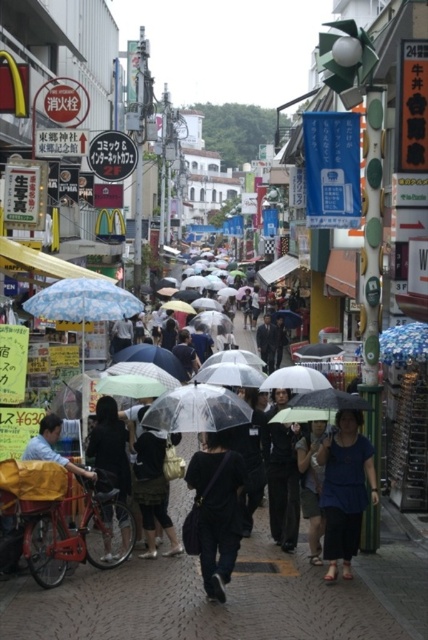
Who is positioned more to the left, black matte bag at center or dark blue fabric shirt at center?

Positioned to the left is black matte bag at center.

This screenshot has height=640, width=428. What are the coordinates of `black matte bag at center` in the screenshot? It's located at (214, 512).